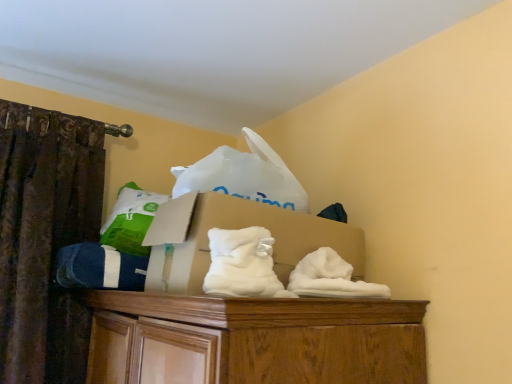
Question: Considering the relative positions of cardboard box at center and white fluffy sheet at center in the image provided, is cardboard box at center behind white fluffy sheet at center?

Choices:
 (A) no
 (B) yes

Answer: (B)

Question: Is cardboard box at center positioned in front of white fluffy sheet at center?

Choices:
 (A) no
 (B) yes

Answer: (A)

Question: Is cardboard box at center facing away from white fluffy sheet at center?

Choices:
 (A) no
 (B) yes

Answer: (A)

Question: Considering the relative sizes of cardboard box at center and white fluffy sheet at center in the image provided, is cardboard box at center bigger than white fluffy sheet at center?

Choices:
 (A) no
 (B) yes

Answer: (B)

Question: Is cardboard box at center outside of white fluffy sheet at center?

Choices:
 (A) no
 (B) yes

Answer: (B)

Question: Do you think cardboard box at center is within blue cotton socks at left, or outside of it?

Choices:
 (A) inside
 (B) outside

Answer: (B)

Question: Relative to blue cotton socks at left, is cardboard box at center in front or behind?

Choices:
 (A) front
 (B) behind

Answer: (A)

Question: Is cardboard box at center taller or shorter than blue cotton socks at left?

Choices:
 (A) tall
 (B) short

Answer: (A)

Question: Considering the positions of cardboard box at center and blue cotton socks at left in the image, is cardboard box at center bigger or smaller than blue cotton socks at left?

Choices:
 (A) small
 (B) big

Answer: (B)

Question: In terms of width, does white fluffy sheet at center look wider or thinner when compared to cardboard box at center?

Choices:
 (A) thin
 (B) wide

Answer: (A)

Question: Is white fluffy sheet at center inside the boundaries of cardboard box at center, or outside?

Choices:
 (A) outside
 (B) inside

Answer: (B)

Question: Looking at the image, does white fluffy sheet at center seem bigger or smaller compared to cardboard box at center?

Choices:
 (A) small
 (B) big

Answer: (A)

Question: Visually, is white fluffy sheet at center positioned to the left or to the right of cardboard box at center?

Choices:
 (A) right
 (B) left

Answer: (B)

Question: Considering the positions of point (221, 284) and point (57, 269), is point (221, 284) closer or farther from the camera than point (57, 269)?

Choices:
 (A) farther
 (B) closer

Answer: (B)

Question: In terms of width, does white fluffy sheet at center look wider or thinner when compared to blue cotton socks at left?

Choices:
 (A) wide
 (B) thin

Answer: (B)